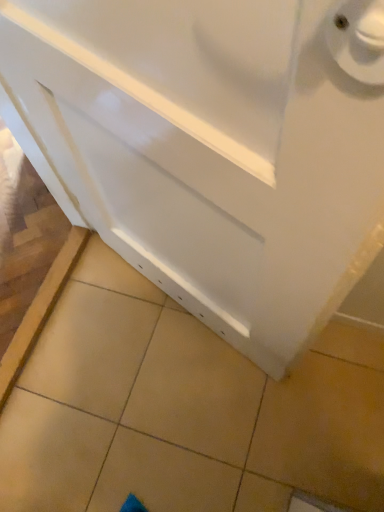
You are a GUI agent. You are given a task and a screenshot of the screen. Output one action in this format:
    pyautogui.click(x=<x>, y=<y>)
    Task: Click on the blank area to the left of white glossy door at center
    
    Given the screenshot: What is the action you would take?
    [x=92, y=347]